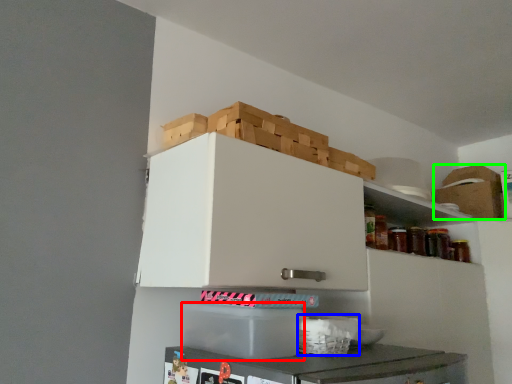
Question: Which object is the closest to the cardboard box (highlighted by a red box)? Choose among these: basket (highlighted by a blue box) or cardboard box (highlighted by a green box).

Choices:
 (A) basket
 (B) cardboard box

Answer: (A)